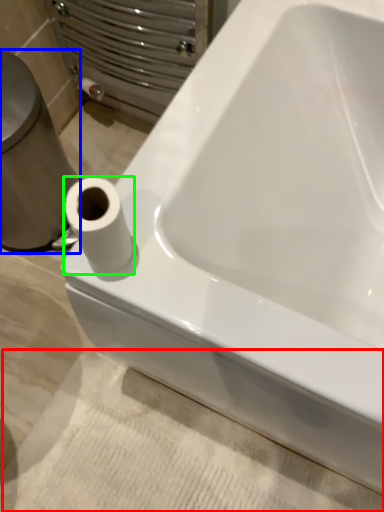
Question: Estimate the real-world distances between objects in this image. Which object is closer to bath mat (highlighted by a red box), porcelain (highlighted by a blue box) or toilet paper (highlighted by a green box)?

Choices:
 (A) porcelain
 (B) toilet paper

Answer: (A)